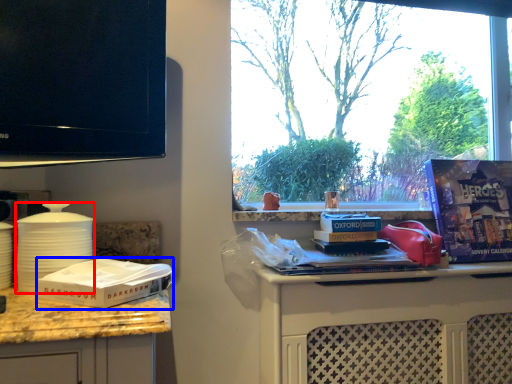
Question: Among these objects, which one is nearest to the camera, kitchen appliance (highlighted by a red box) or box (highlighted by a blue box)?

Choices:
 (A) kitchen appliance
 (B) box

Answer: (B)